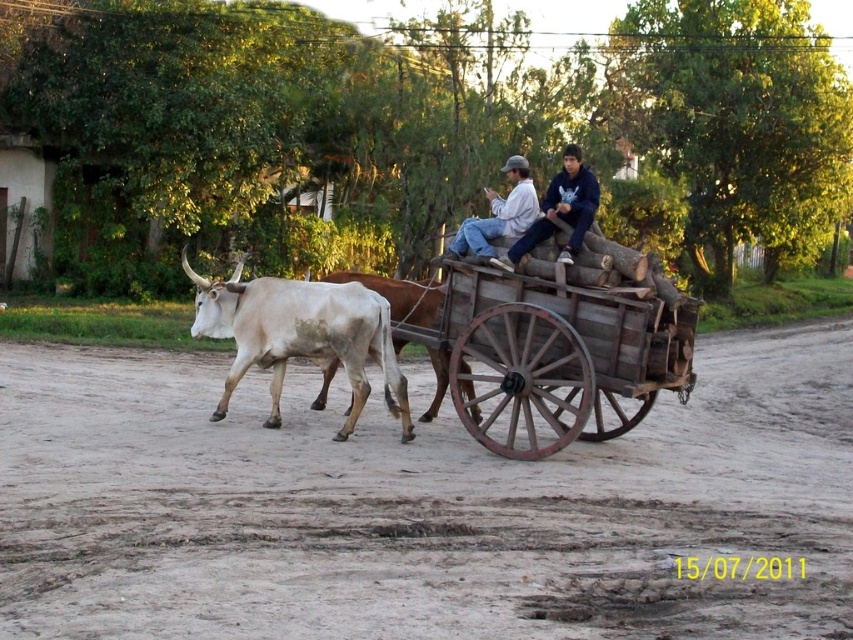
You are standing at point (456, 253) and want to walk to the wooden cart being pulled by two oxen. Is the path to the wooden cart blocked by the point (738, 577)?

Point (738, 577) is in front of point (456, 253), so the path to the wooden cart is blocked by point (738, 577).

You are standing at the edge of the dirt road in the rural scene. You need to determine if you can safely walk between the white smooth bull at center and the white leather jacket at center without getting too close. The safe distance required is 3 feet. Can you walk between them?

The white smooth bull at center is 7.58 feet away from the white leather jacket at center. Since the required safe distance is 3 feet, you can safely walk between them as the distance between them is more than sufficient.

Based on the photo, you are standing at the point with coordinates point (418, 508) in the image. What is the color of the ground beneath your feet?

The point (418, 508) corresponds to the brown dirt field at center, so the ground beneath your feet is brown.